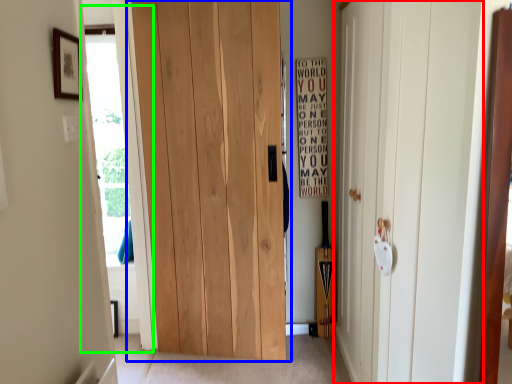
Question: Which is farther away from door (highlighted by a red box)? door (highlighted by a blue box) or glass door (highlighted by a green box)?

Choices:
 (A) door
 (B) glass door

Answer: (B)